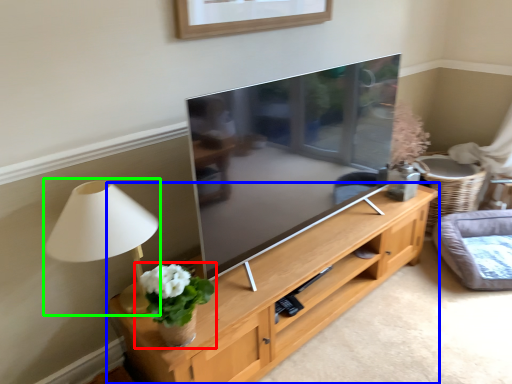
Question: Considering the real-world distances, which object is closest to houseplant (highlighted by a red box)? shelf (highlighted by a blue box) or table lamp (highlighted by a green box).

Choices:
 (A) shelf
 (B) table lamp

Answer: (B)